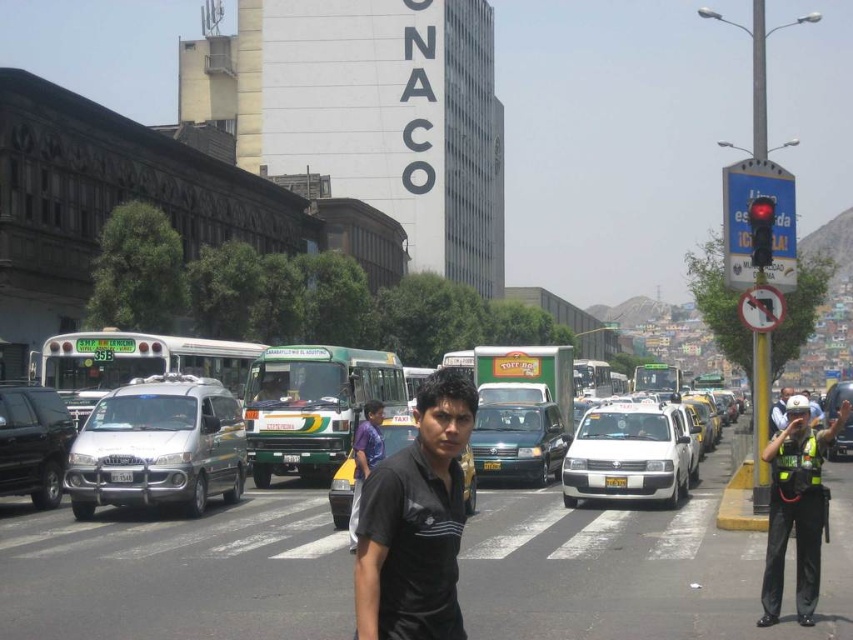
Question: Which object is the farthest from the silver metallic van at center?

Choices:
 (A) reflective silver helmet at right
 (B) black shirt at center
 (C) metallic silver van at center
 (D) metallic silver car at right

Answer: (B)

Question: Can you confirm if silver metallic van at center is smaller than white matte taxi at center?

Choices:
 (A) yes
 (B) no

Answer: (B)

Question: Is white matte taxi at center wider than purple fabric shirt at center?

Choices:
 (A) yes
 (B) no

Answer: (A)

Question: Can you confirm if white matte taxi at center is positioned to the left of black shirt at center?

Choices:
 (A) yes
 (B) no

Answer: (A)

Question: Which object appears closest to the camera in this image?

Choices:
 (A) metallic silver van at center
 (B) black shirt at center
 (C) metallic silver sedan at center
 (D) reflective silver helmet at right

Answer: (A)

Question: Which object is closer to the camera taking this photo?

Choices:
 (A) metallic silver car at right
 (B) white matte taxi at center
 (C) reflective silver helmet at right

Answer: (C)